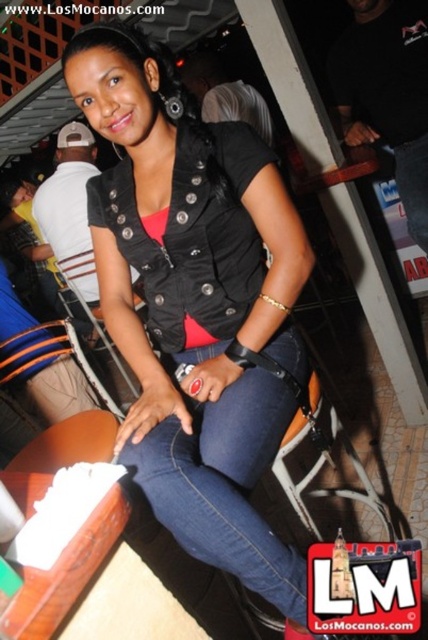
Question: Does metallic silver chair at lower center appear on the right side of metallic silver chair at center?

Choices:
 (A) yes
 (B) no

Answer: (A)

Question: Among these points, which one is nearest to the camera?

Choices:
 (A) (318, 412)
 (B) (115, 282)
 (C) (190, 552)
 (D) (71, 317)

Answer: (C)

Question: Among these points, which one is farthest from the camera?

Choices:
 (A) (134, 298)
 (B) (256, 444)
 (C) (309, 384)

Answer: (A)

Question: Is metallic silver chair at lower center bigger than metallic silver chair at center?

Choices:
 (A) yes
 (B) no

Answer: (B)

Question: Which object is the farthest from the black matte vest at center?

Choices:
 (A) metallic silver chair at lower center
 (B) denim jeans at center
 (C) metallic silver chair at center

Answer: (C)

Question: Is black matte vest at center bigger than metallic silver chair at center?

Choices:
 (A) no
 (B) yes

Answer: (A)